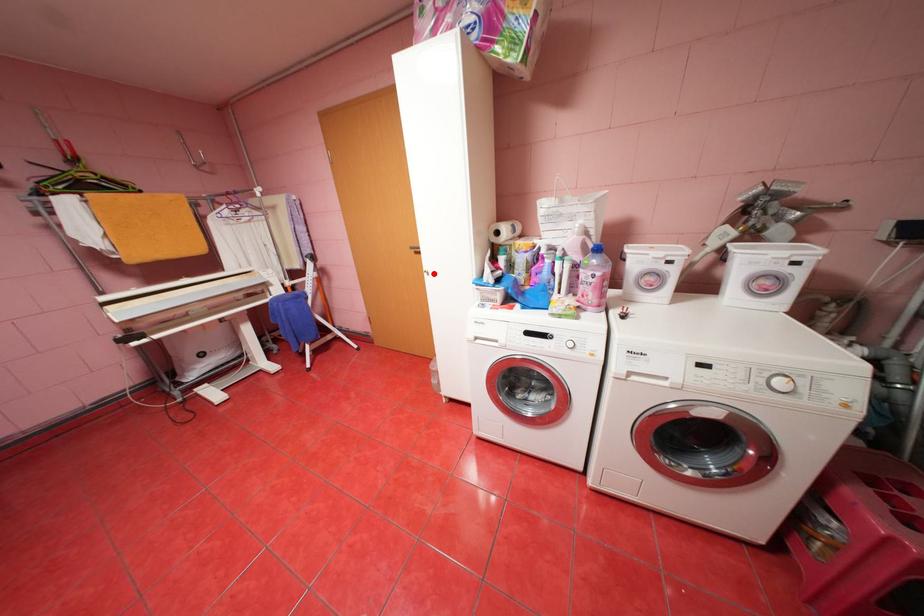
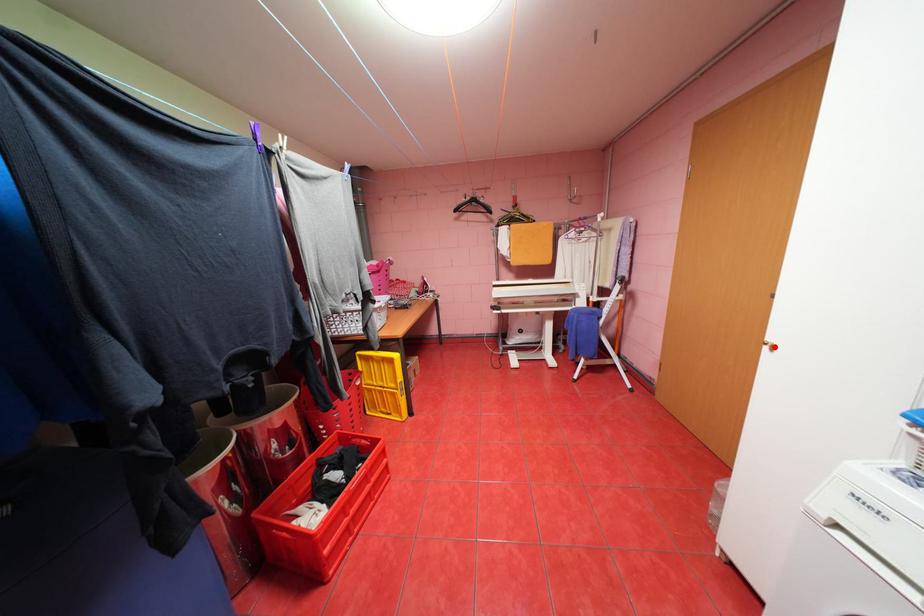
Looking at this image, I am providing you with two images of the same scene from different viewpoints. A red point is marked on the first image and another point is marked on the second image. Is the red point in image1 aligned with the point shown in image2?

Yes